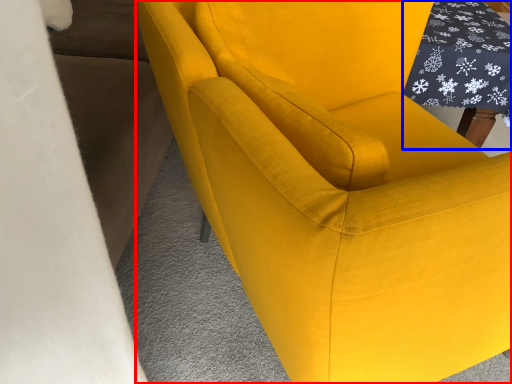
Question: Which of the following is the closest to the observer, chair (highlighted by a red box) or table (highlighted by a blue box)?

Choices:
 (A) chair
 (B) table

Answer: (A)